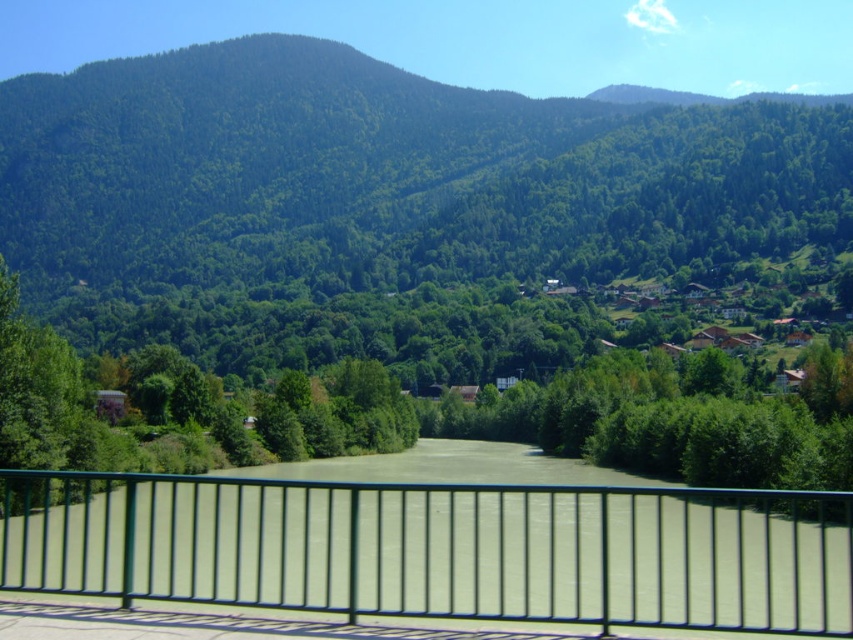
Question: Which point is farther to the camera?

Choices:
 (A) (372, 416)
 (B) (718, 259)

Answer: (B)

Question: Which of the following is the farthest from the observer?

Choices:
 (A) green forested mountain at upper center
 (B) green leafy tree at center
 (C) black metal fence at center

Answer: (A)

Question: Does black metal fence at center have a lesser width compared to green leafy tree at center?

Choices:
 (A) yes
 (B) no

Answer: (A)

Question: Which of the following is the farthest from the observer?

Choices:
 (A) green forested mountain at upper center
 (B) black metal fence at center

Answer: (A)

Question: Is black metal fence at center below green leafy tree at center?

Choices:
 (A) yes
 (B) no

Answer: (B)

Question: Is green forested mountain at upper center wider than black metal fence at center?

Choices:
 (A) no
 (B) yes

Answer: (B)